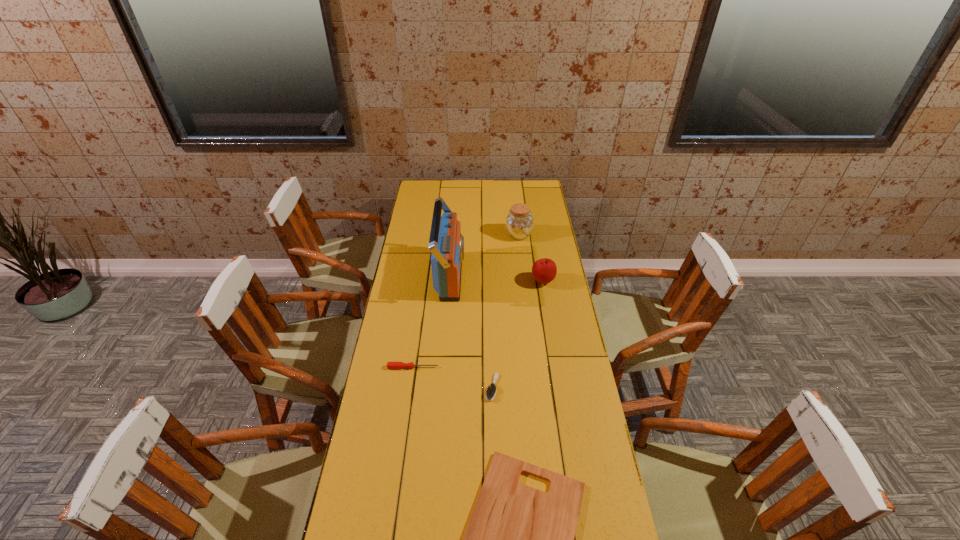
The image size is (960, 540). In order to click on free spot that satisfies the following two spatial constraints: 1. on the front-facing side of the tallest object; 2. on the left side of the fourth shortest object in this screenshot , I will do point(449,281).